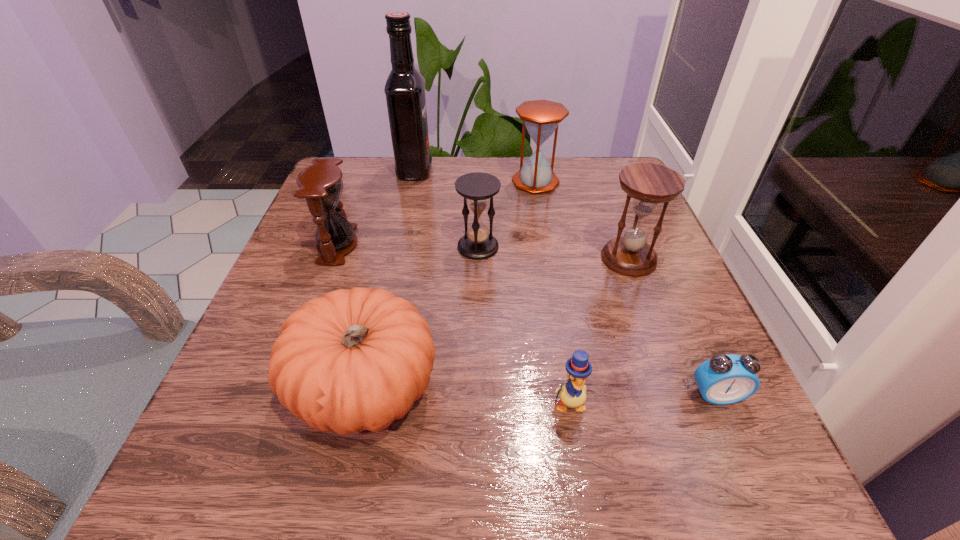
This screenshot has height=540, width=960. I want to click on vacant region at the far right corner of the desktop, so click(x=620, y=190).

The width and height of the screenshot is (960, 540). In order to click on vacant space in between the farthest hourglass and the leftmost hourglass in this screenshot , I will do `click(437, 213)`.

Where is `blank region between the shortest object and the duckling`? The height and width of the screenshot is (540, 960). blank region between the shortest object and the duckling is located at coordinates (642, 399).

Find the location of `vacant area that lies between the alarm clock and the liquor`. vacant area that lies between the alarm clock and the liquor is located at coordinates (565, 283).

You are a GUI agent. You are given a task and a screenshot of the screen. Output one action in this format:
    pyautogui.click(x=<x>, y=<y>)
    Task: Click on the blank region between the pumpkin and the rightmost hourglass
    
    Given the screenshot: What is the action you would take?
    pyautogui.click(x=497, y=324)

Identify the location of empty space between the leftmost hourglass and the liquor. (376, 208).

Where is `free space between the leftmost hourglass and the fourth object from left to right`? The width and height of the screenshot is (960, 540). free space between the leftmost hourglass and the fourth object from left to right is located at coordinates (408, 246).

This screenshot has width=960, height=540. Find the location of `vacant region between the leftmost hourglass and the alarm clock`. vacant region between the leftmost hourglass and the alarm clock is located at coordinates (527, 320).

This screenshot has width=960, height=540. What are the coordinates of `the fourth closest object to the pumpkin` in the screenshot? It's located at (648, 184).

Choose which object is the fifth nearest neighbor to the liquor. Please provide its 2D coordinates. Your answer should be formatted as a tuple, i.e. [(x, y)], where the tuple contains the x and y coordinates of a point satisfying the conditions above.

[(351, 360)]